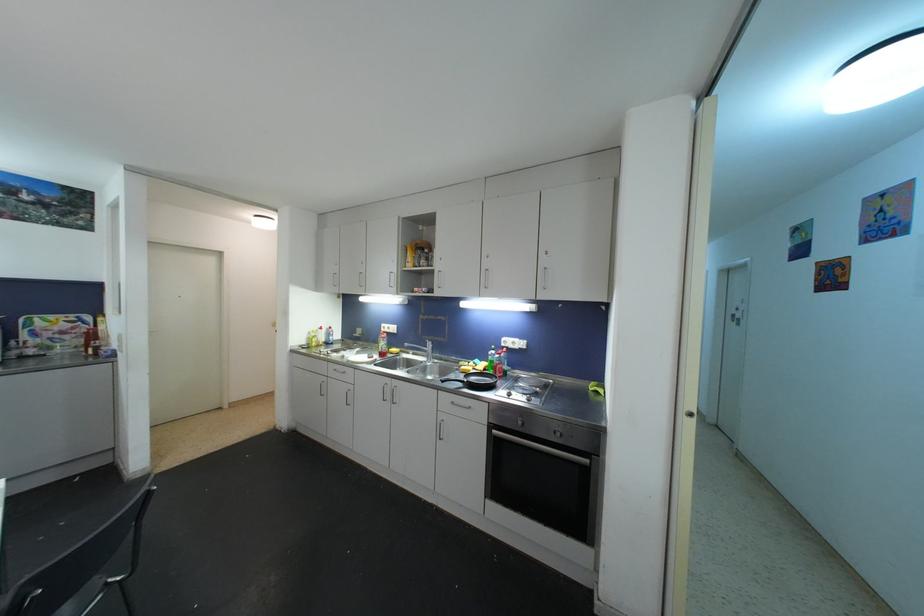
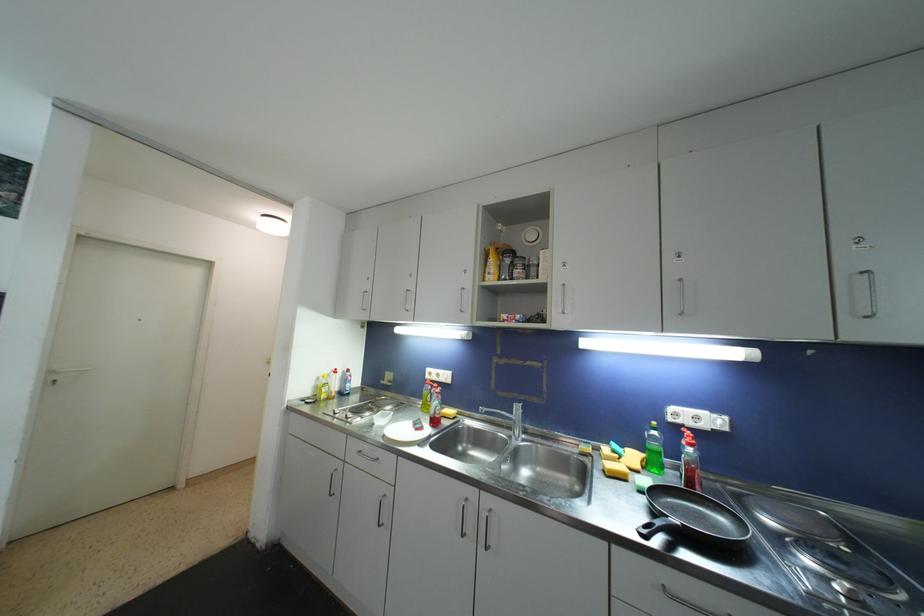
The point at (392, 331) is marked in the first image. Where is the corresponding point in the second image?

(441, 378)